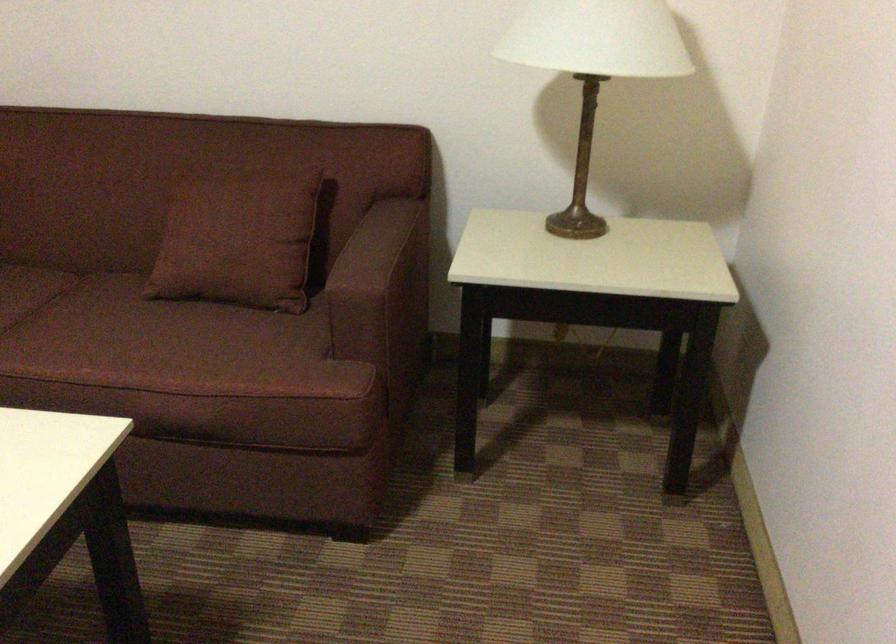
Where is `sofa armrest`? This screenshot has width=896, height=644. sofa armrest is located at coordinates (367, 254).